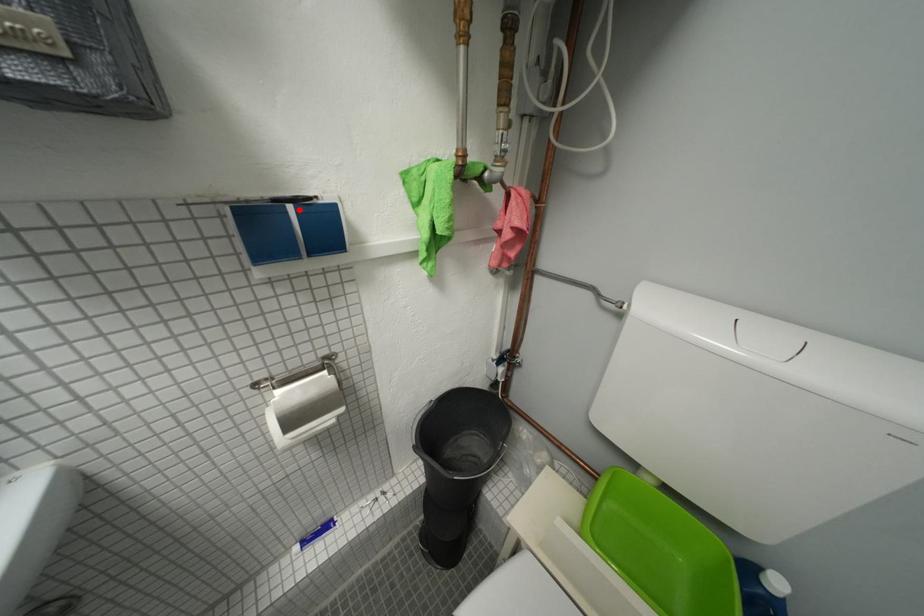
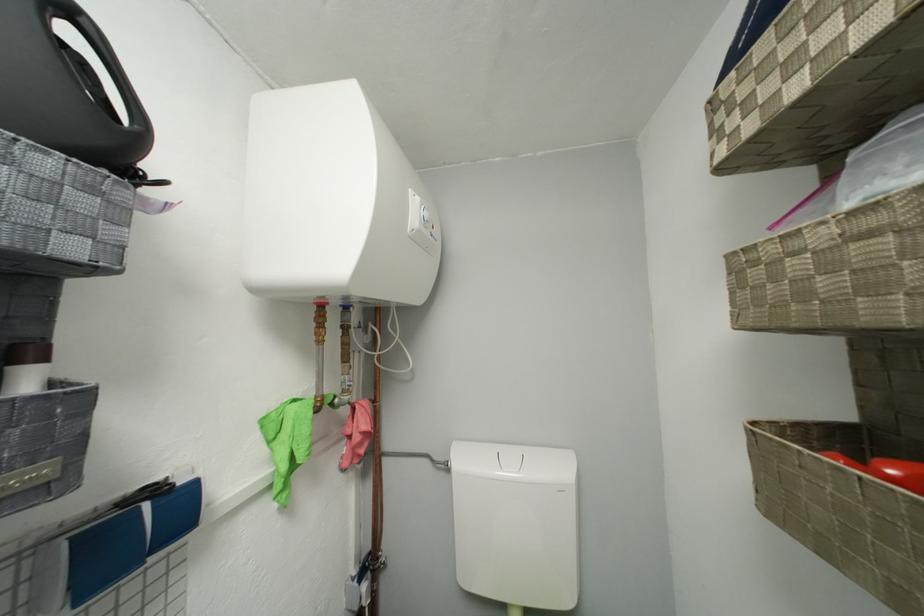
Question: I am providing you with two images of the same scene from different viewpoints. A red point is marked on the first image. Can you still see the location of the red point in image 2?

Choices:
 (A) Yes
 (B) No

Answer: (A)